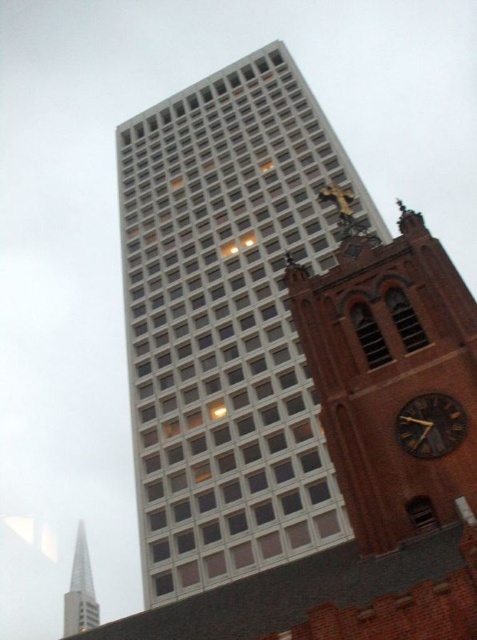
You are a city planner assessing building heights for zoning compliance. The zoning law states that no new building can exceed the height of existing historical structures by more than 20 percent. Given that the brown brick clock tower at right is 50 meters tall, does the white glass building at center comply with the zoning law?

The white glass building at center is much taller than the brown brick clock tower at right. Since the clock tower is 50 meters tall, the building exceeds the 20 percent height limit, so it does not comply with the zoning law.

You are a drone operator trying to capture a photo of both the brown brick clock tower at right and the shiny silver spire at lower left. Based on their positions, which one should you focus on first to ensure both are in frame?

The brown brick clock tower at right is above the shiny silver spire at lower left, so you should focus on the shiny silver spire at lower left first to ensure both are in frame.